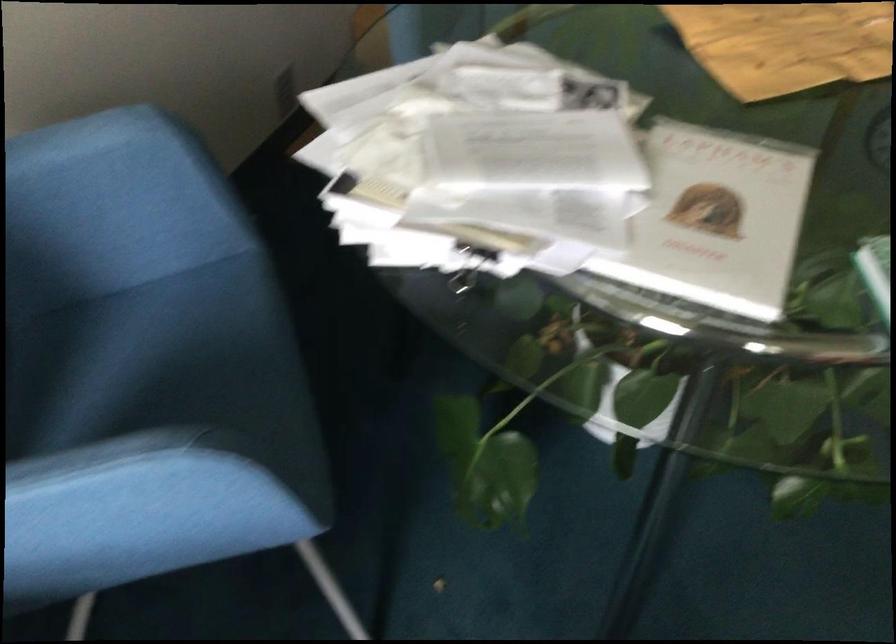
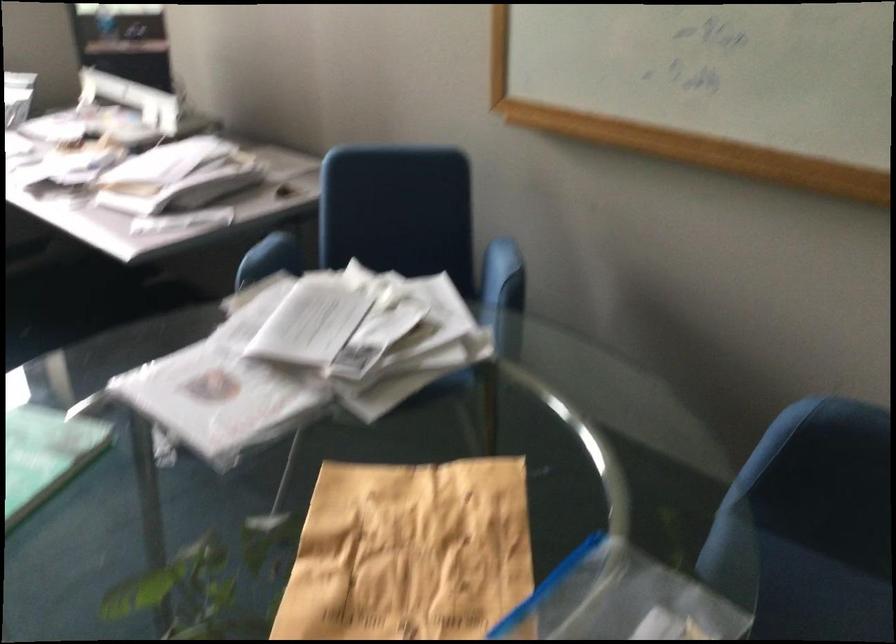
Question: I am providing you with two images of the same scene from different viewpoints. After the viewpoint changes to image2, which objects are now occluded?

Choices:
 (A) blue chair armrest
 (B) white spherical object
 (C) plastic ziplock bag
 (D) blue chair sitting surface

Answer: (D)